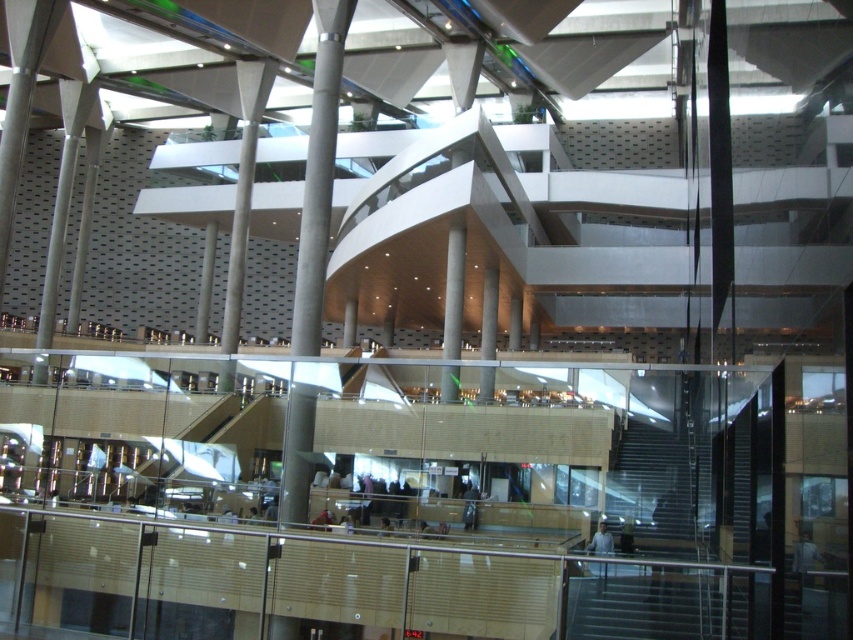
You are an architect designing a new building and want to ensure that the concrete column at center and smooth concrete pillar at center are positioned correctly. Based on the image, which object is located higher up in the scene?

The concrete column at center is located higher up than the smooth concrete pillar at center because it is positioned above it according to the description.

You are an architect designing a new building and want to ensure that the smooth concrete pillar at center and the satin gray column at center are proportionally balanced. Given their height difference, which column should be placed in a position where height is less critical for structural support?

The satin gray column at center should be placed in a position where height is less critical for structural support since it has a shorter height compared to the smooth concrete pillar at center.

You are an architect designing a new building and want to ensure that the concrete column at center and the satin gray column at center are proportionally balanced. Given their height difference, what adjustment could you make to achieve this balance?

Since the concrete column at center is much taller than the satin gray column at center, you could shorten the concrete column or add height to the satin gray column to create a more balanced proportion between the two.